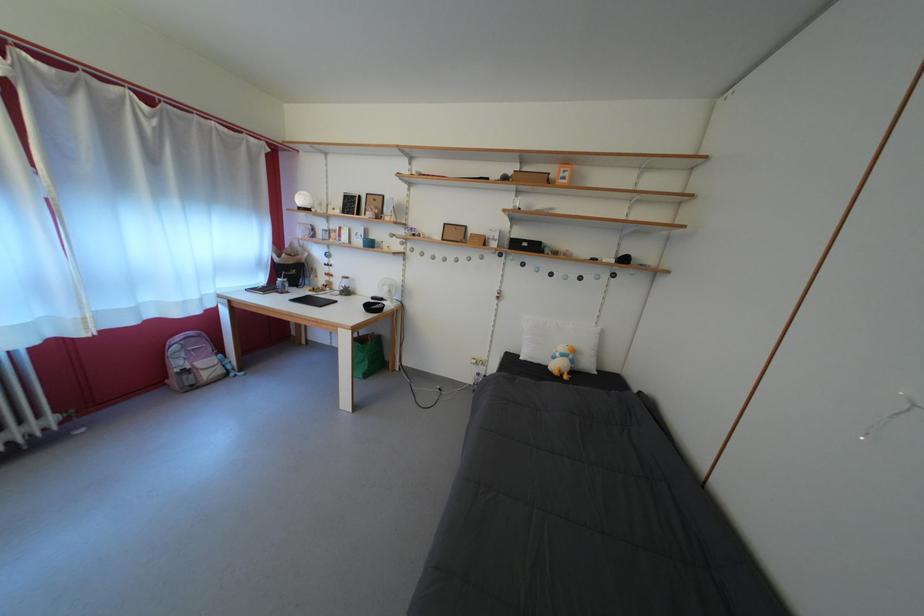
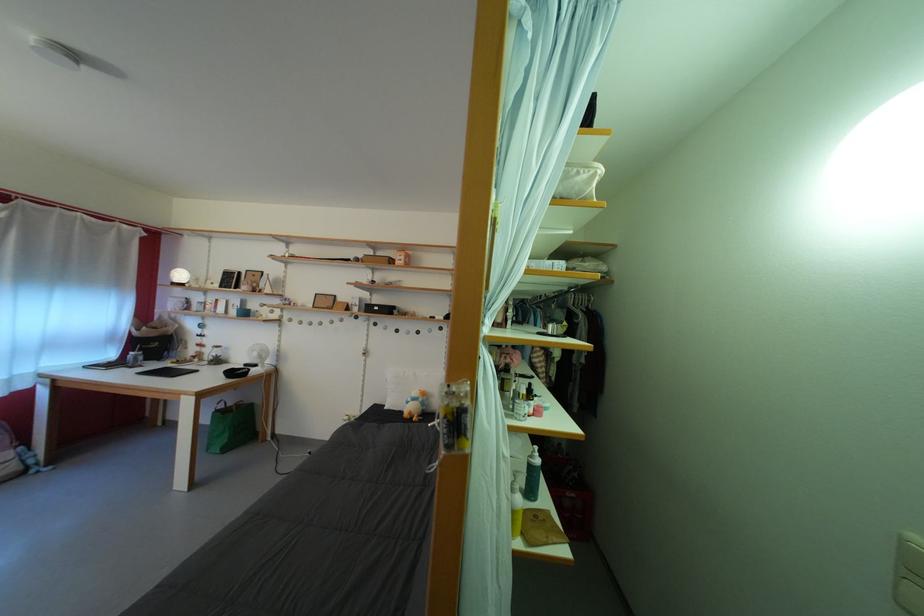
In a continuous first-person perspective shot, in which direction is the camera moving?

The cameraman walked toward right, backward.